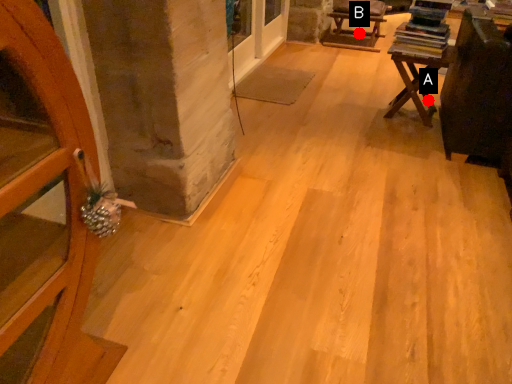
Question: Two points are circled on the image, labeled by A and B beside each circle. Which point is closer to the camera taking this photo?

Choices:
 (A) A is closer
 (B) B is closer

Answer: (A)